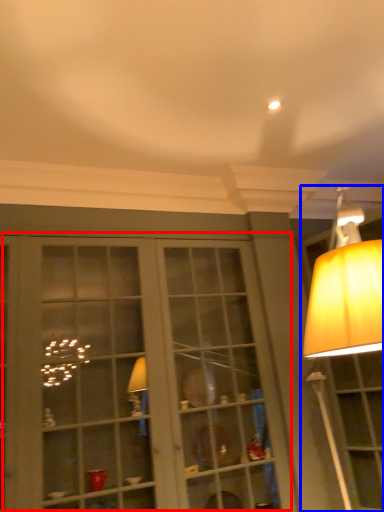
Question: Which point is closer to the camera, bay window (highlighted by a red box) or lamp (highlighted by a blue box)?

Choices:
 (A) bay window
 (B) lamp

Answer: (A)